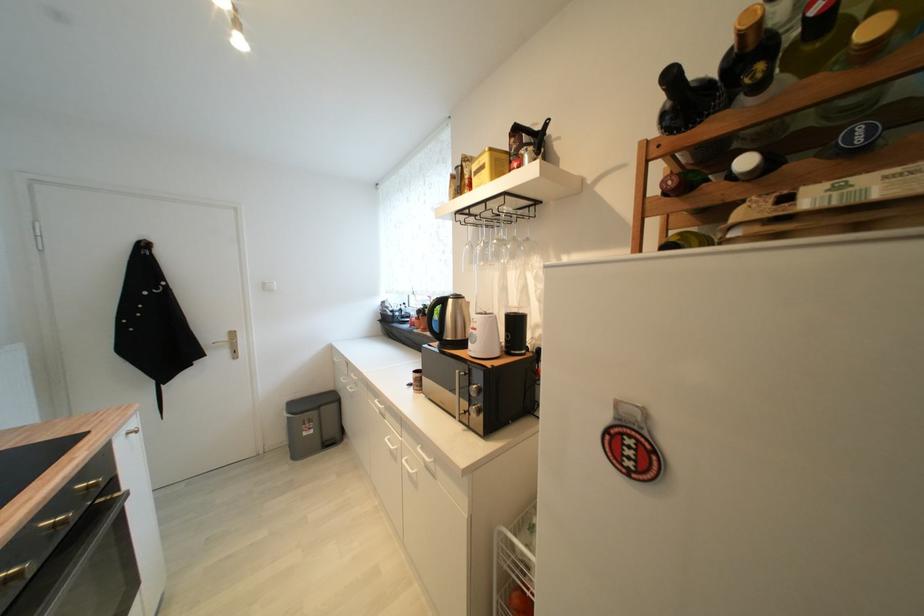
This screenshot has width=924, height=616. Describe the element at coordinates (479, 397) in the screenshot. I see `a microwave dial` at that location.